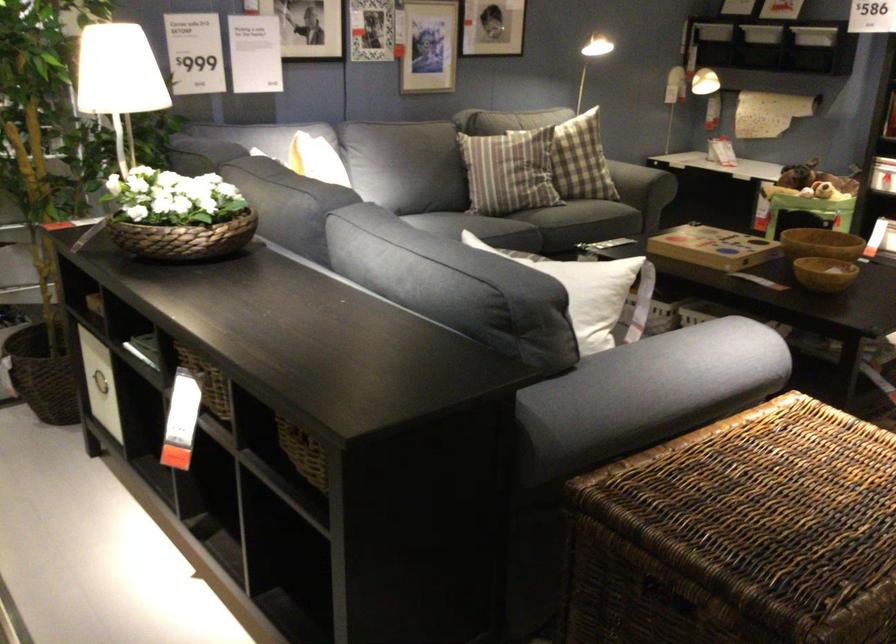
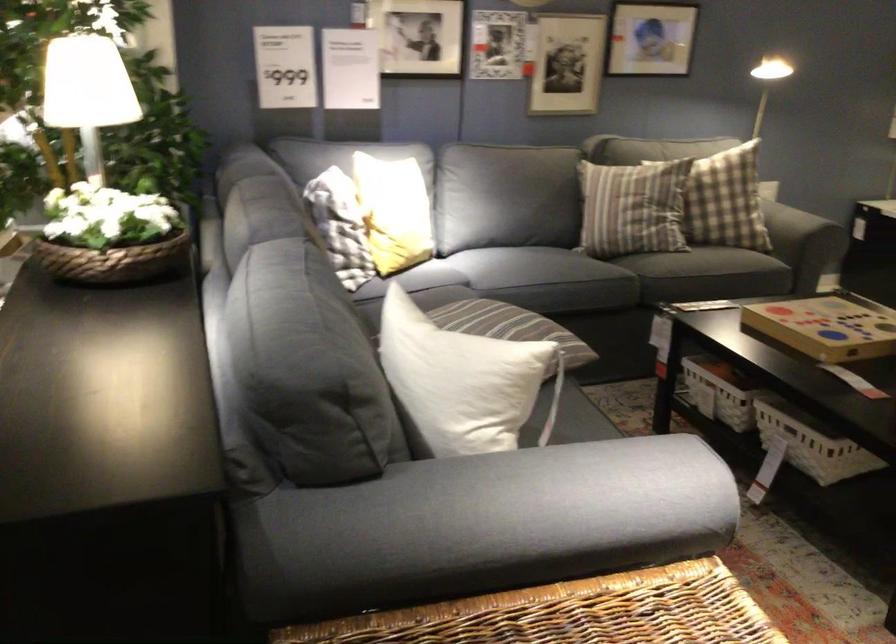
Find the pixel in the second image that matches point 531,184 in the first image.

(633, 207)